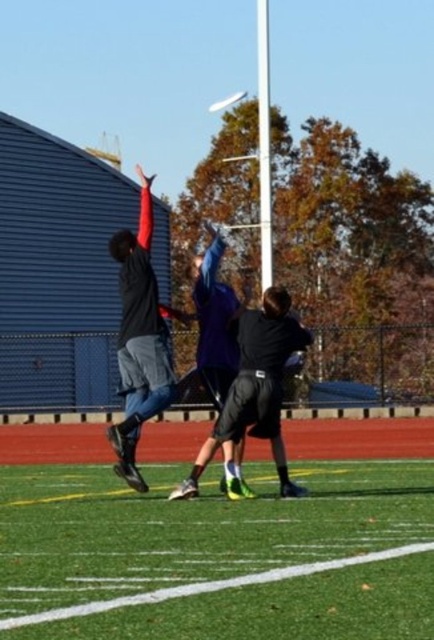
Question: Can you confirm if green artificial turf at center is smaller than black matte shorts at center?

Choices:
 (A) no
 (B) yes

Answer: (B)

Question: Which point is closer to the camera?

Choices:
 (A) (122, 244)
 (B) (111, 602)

Answer: (B)

Question: Considering the relative positions of green artificial turf at center and black matte shorts at center in the image provided, where is green artificial turf at center located with respect to black matte shorts at center?

Choices:
 (A) right
 (B) left

Answer: (A)

Question: Is green artificial turf at center below black matte shorts at center?

Choices:
 (A) no
 (B) yes

Answer: (B)